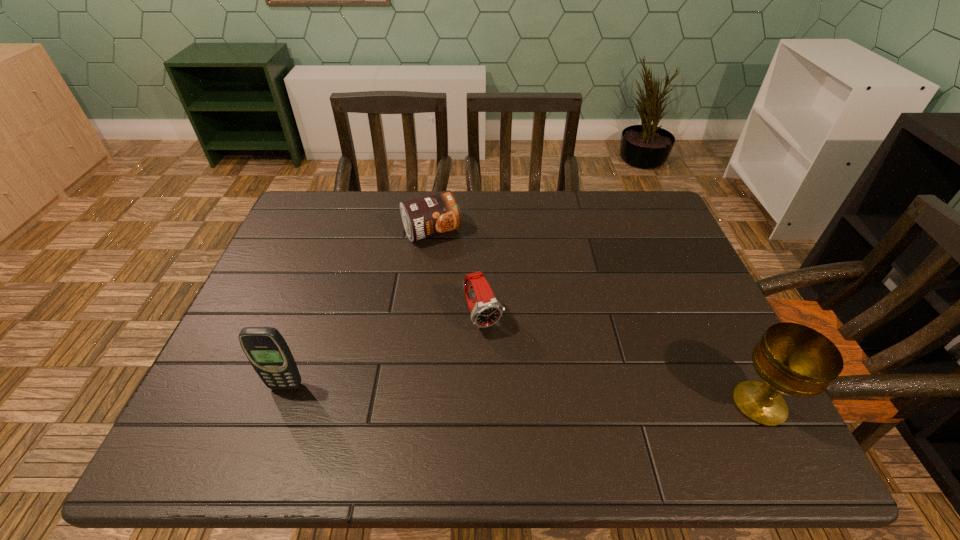
At what (x,y) coordinates should I click in order to perform the action: click on free space located on the front label of the can. Please return your answer as a coordinate pair (x, y). The image size is (960, 540). Looking at the image, I should click on (469, 290).

This screenshot has width=960, height=540. I want to click on free region located on the face of the watch, so click(518, 391).

The image size is (960, 540). I want to click on free location located on the face of the watch, so click(x=518, y=391).

At what (x,y) coordinates should I click in order to perform the action: click on free spot located 0.190m on the face of the watch. Please return your answer as a coordinate pair (x, y). This screenshot has height=540, width=960. Looking at the image, I should click on coord(527,407).

Find the location of a particular element. This screenshot has width=960, height=540. object that is positioned at the far edge is located at coordinates (431, 215).

At what (x,y) coordinates should I click in order to perform the action: click on cellular telephone situated at the near edge. Please return your answer as a coordinate pair (x, y). Looking at the image, I should click on (266, 349).

Locate an element on the screen. The image size is (960, 540). chalice that is at the near edge is located at coordinates (793, 359).

Locate an element on the screen. The height and width of the screenshot is (540, 960). object present at the left edge is located at coordinates (266, 349).

The height and width of the screenshot is (540, 960). Identify the location of object that is at the right edge. (793, 359).

At what (x,y) coordinates should I click in order to perform the action: click on object situated at the near left corner. Please return your answer as a coordinate pair (x, y). Image resolution: width=960 pixels, height=540 pixels. Looking at the image, I should click on (266, 349).